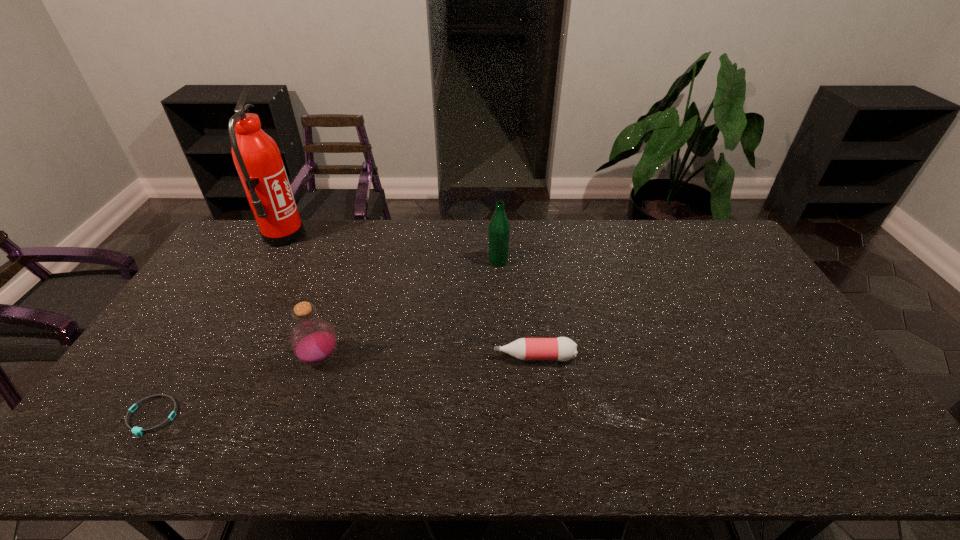
The width and height of the screenshot is (960, 540). I want to click on vacant space that satisfies the following two spatial constraints: 1. on the label side of the fire extinguisher; 2. on the right side of the second tallest object, so click(269, 261).

Identify the location of free location that satisfies the following two spatial constraints: 1. with the cap open on the second shortest object; 2. on the buckle of the wristband. The height and width of the screenshot is (540, 960). (541, 416).

You are a GUI agent. You are given a task and a screenshot of the screen. Output one action in this format:
    pyautogui.click(x=<x>, y=<y>)
    Task: Click on the vacant area that satisfies the following two spatial constraints: 1. on the label side of the tallest object; 2. on the left side of the second shortest bottle
    
    Given the screenshot: What is the action you would take?
    pyautogui.click(x=213, y=359)